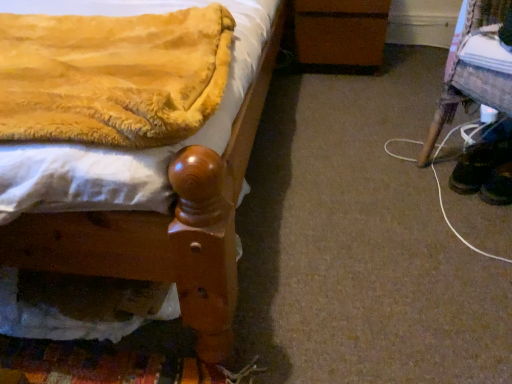
Question: Is velvet yellow blanket at upper left behind black suede shoes at lower right, which is the 2th footwear in left-to-right order?

Choices:
 (A) no
 (B) yes

Answer: (A)

Question: Does velvet yellow blanket at upper left have a smaller size compared to black suede shoes at lower right, which is the 2th footwear in left-to-right order?

Choices:
 (A) yes
 (B) no

Answer: (B)

Question: From the image's perspective, is velvet yellow blanket at upper left beneath black suede shoes at lower right, the first footwear when ordered from right to left?

Choices:
 (A) yes
 (B) no

Answer: (B)

Question: Can you confirm if velvet yellow blanket at upper left is wider than black suede shoes at lower right, the first footwear when ordered from right to left?

Choices:
 (A) yes
 (B) no

Answer: (A)

Question: Is velvet yellow blanket at upper left positioned far away from black suede shoes at lower right, which is the 2th footwear in left-to-right order?

Choices:
 (A) yes
 (B) no

Answer: (A)

Question: Does velvet yellow blanket at upper left have a larger size compared to black suede shoes at lower right, the first footwear when ordered from right to left?

Choices:
 (A) no
 (B) yes

Answer: (B)

Question: Does wooden stool at lower right appear on the right side of wooden bedpost at left?

Choices:
 (A) no
 (B) yes

Answer: (B)

Question: Considering the relative sizes of wooden stool at lower right and wooden bedpost at left in the image provided, is wooden stool at lower right smaller than wooden bedpost at left?

Choices:
 (A) yes
 (B) no

Answer: (A)

Question: From the image's perspective, is wooden stool at lower right beneath wooden bedpost at left?

Choices:
 (A) no
 (B) yes

Answer: (B)

Question: Could you tell me if wooden stool at lower right is turned towards wooden bedpost at left?

Choices:
 (A) yes
 (B) no

Answer: (A)

Question: Is wooden stool at lower right surrounding wooden bedpost at left?

Choices:
 (A) no
 (B) yes

Answer: (A)

Question: Is wooden stool at lower right not within wooden bedpost at left?

Choices:
 (A) yes
 (B) no

Answer: (A)

Question: Can you confirm if wooden stool at lower right is bigger than brown wooden changing table at center?

Choices:
 (A) no
 (B) yes

Answer: (B)